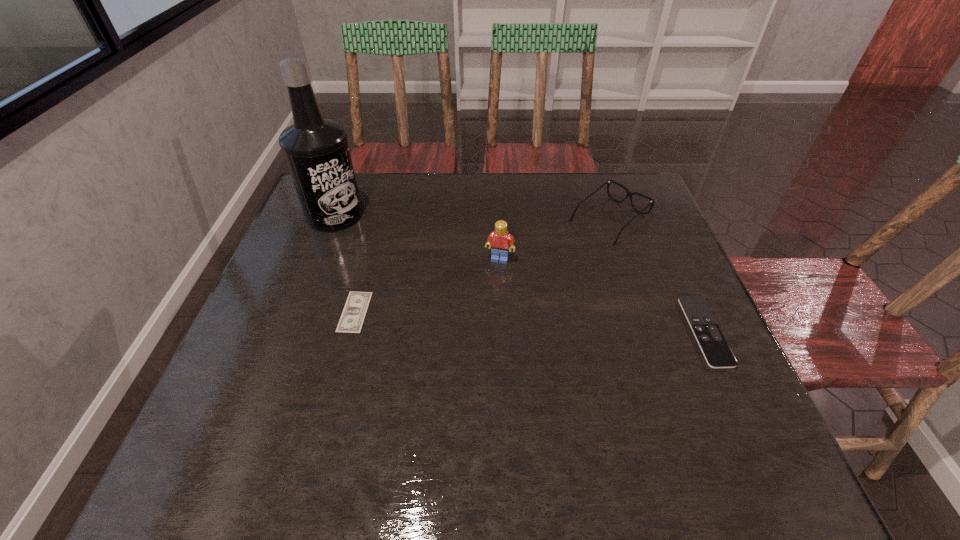
Locate an element on the screen. Image resolution: width=960 pixels, height=540 pixels. free space between the second tallest object and the third shortest object is located at coordinates (555, 239).

Where is `the third closest object to the fourth tallest object`? the third closest object to the fourth tallest object is located at coordinates (353, 315).

Locate which object ranks second in proximity to the fourth tallest object. Please provide its 2D coordinates. Your answer should be formatted as a tuple, i.e. [(x, y)], where the tuple contains the x and y coordinates of a point satisfying the conditions above.

[(499, 240)]

Where is `free space that satisfies the following two spatial constraints: 1. on the back side of the third shortest object; 2. on the right side of the third nearest object`? This screenshot has height=540, width=960. free space that satisfies the following two spatial constraints: 1. on the back side of the third shortest object; 2. on the right side of the third nearest object is located at coordinates (498, 219).

Where is `vacant point that satisfies the following two spatial constraints: 1. on the front side of the shortest object; 2. on the left side of the tallest object`? The height and width of the screenshot is (540, 960). vacant point that satisfies the following two spatial constraints: 1. on the front side of the shortest object; 2. on the left side of the tallest object is located at coordinates (298, 312).

Identify the location of blank space that satisfies the following two spatial constraints: 1. on the front side of the Lego; 2. on the right side of the tallest object. (318, 259).

Locate an element on the screen. The width and height of the screenshot is (960, 540). free location that satisfies the following two spatial constraints: 1. on the front side of the tallest object; 2. on the left side of the spectacles is located at coordinates (333, 219).

The width and height of the screenshot is (960, 540). Identify the location of vacant space that satisfies the following two spatial constraints: 1. on the front side of the third shortest object; 2. on the left side of the remote control. (647, 332).